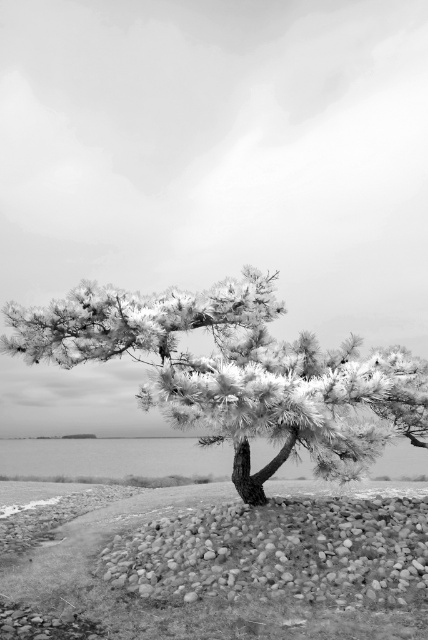
Question: Which point is farther from the camera taking this photo?

Choices:
 (A) [27, 472]
 (B) [424, 580]
 (C) [168, 314]

Answer: (A)

Question: Which object is closer to the camera taking this photo?

Choices:
 (A) frosty pine tree at center
 (B) transparent water at center

Answer: (A)

Question: Does frosty pine tree at center appear on the left side of transparent water at center?

Choices:
 (A) no
 (B) yes

Answer: (B)

Question: Can you confirm if frosty pine tree at center is thinner than transparent water at center?

Choices:
 (A) no
 (B) yes

Answer: (B)

Question: Which object appears farthest from the camera in this image?

Choices:
 (A) frosty pine tree at center
 (B) smooth pebbles at center

Answer: (A)

Question: Is frosty pine tree at center above transparent water at center?

Choices:
 (A) yes
 (B) no

Answer: (A)